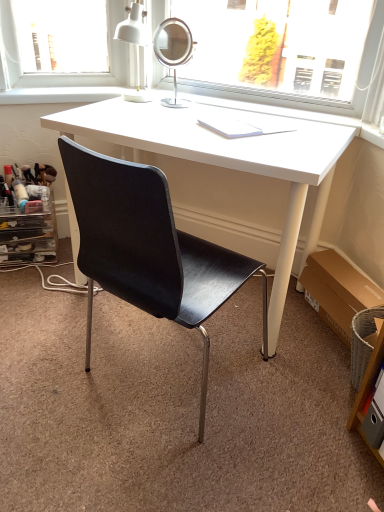
Question: Should I look upward or downward to see white paper at center?

Choices:
 (A) down
 (B) up

Answer: (B)

Question: Does white glossy desk at center have a greater width compared to white paper at center?

Choices:
 (A) no
 (B) yes

Answer: (B)

Question: Is white glossy desk at center taller than white paper at center?

Choices:
 (A) yes
 (B) no

Answer: (A)

Question: From the image's perspective, is white glossy desk at center located beneath white paper at center?

Choices:
 (A) yes
 (B) no

Answer: (A)

Question: From a real-world perspective, is white glossy desk at center positioned over white paper at center based on gravity?

Choices:
 (A) no
 (B) yes

Answer: (A)

Question: Considering the relative positions of white glossy desk at center and white paper at center in the image provided, is white glossy desk at center to the left of white paper at center from the viewer's perspective?

Choices:
 (A) no
 (B) yes

Answer: (B)

Question: Does white glossy desk at center have a lesser height compared to white paper at center?

Choices:
 (A) no
 (B) yes

Answer: (A)

Question: Is white matte table lamp at upper center wider than wooden shelf at lower right, marked as the 1th shelf in a front-to-back arrangement?

Choices:
 (A) no
 (B) yes

Answer: (B)

Question: From the image's perspective, is white matte table lamp at upper center beneath wooden shelf at lower right, marked as the 1th shelf in a front-to-back arrangement?

Choices:
 (A) yes
 (B) no

Answer: (B)

Question: Is white matte table lamp at upper center bigger than wooden shelf at lower right, which is counted as the 2th shelf, starting from the top?

Choices:
 (A) no
 (B) yes

Answer: (B)

Question: Can we say white matte table lamp at upper center lies outside wooden shelf at lower right, which appears as the first shelf when viewed from the right?

Choices:
 (A) no
 (B) yes

Answer: (B)

Question: Is white matte table lamp at upper center taller than wooden shelf at lower right, marked as the 1th shelf in a front-to-back arrangement?

Choices:
 (A) no
 (B) yes

Answer: (B)

Question: Does white matte table lamp at upper center have a lesser height compared to wooden shelf at lower right, which ranks as the first shelf in bottom-to-top order?

Choices:
 (A) no
 (B) yes

Answer: (A)

Question: Does black leather chair at center come in front of white glossy desk at center?

Choices:
 (A) no
 (B) yes

Answer: (B)